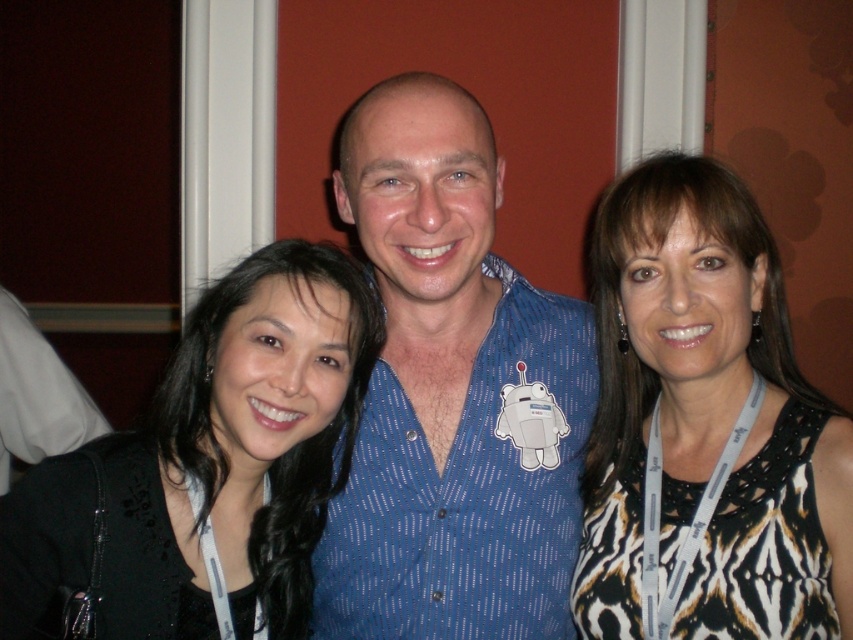
Between blue dotted shirt at center and white fabric at left, which one is positioned lower?

white fabric at left

What do you see at coordinates (451, 394) in the screenshot? This screenshot has height=640, width=853. I see `blue dotted shirt at center` at bounding box center [451, 394].

Identify the location of blue dotted shirt at center. The width and height of the screenshot is (853, 640). (451, 394).

Does printed fabric dress at right have a lesser height compared to black fabric at left?

No, printed fabric dress at right is not shorter than black fabric at left.

Is point (675, 227) behind point (291, 548)?

No, it is in front of (291, 548).

Image resolution: width=853 pixels, height=640 pixels. I want to click on printed fabric dress at right, so click(706, 422).

Which is behind, point (780, 525) or point (1, 292)?

The point (1, 292) is behind.

At what (x,y) coordinates should I click in order to perform the action: click on printed fabric dress at right. Please return your answer as a coordinate pair (x, y). Looking at the image, I should click on (706, 422).